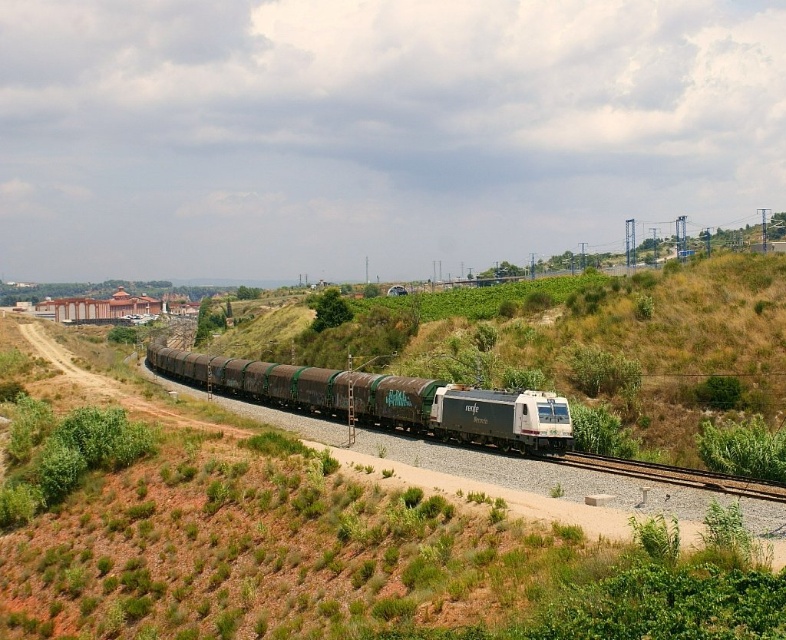
Is point (483, 420) less distant than point (605, 470)?

No, (483, 420) is further to viewer.

Between point (178, 358) and point (573, 451), which one is positioned behind?

The point (178, 358) is more distant.

Identify the location of matte brown train carriages at center. This screenshot has height=640, width=786. (384, 400).